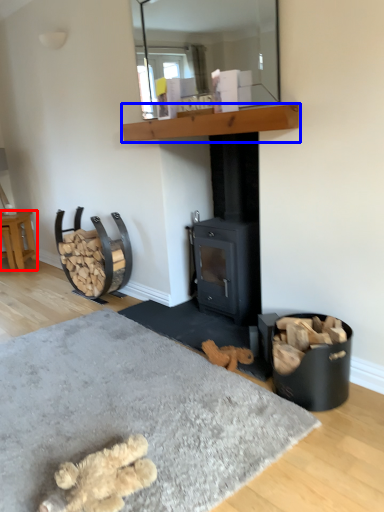
Question: Which point is closer to the camera, furniture (highlighted by a red box) or shelf (highlighted by a blue box)?

Choices:
 (A) furniture
 (B) shelf

Answer: (B)